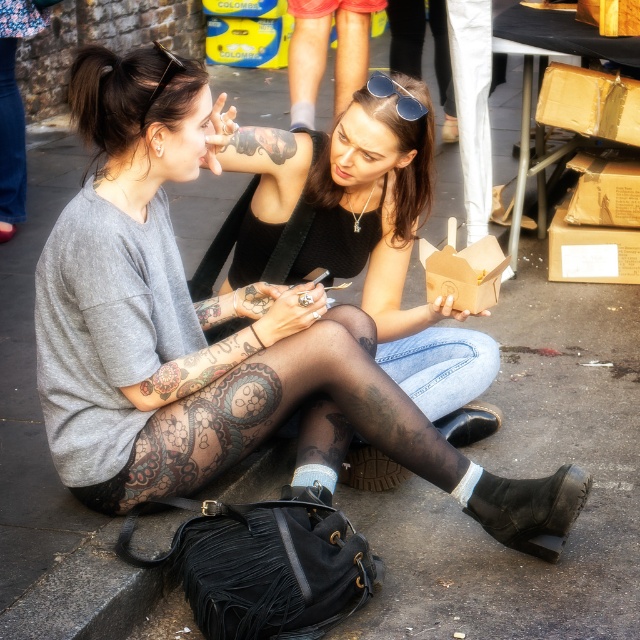
You are a photographer setting up a shot of the two people in the scene. You need to ensure that the matte black sunglasses at upper center and the sunglasses at center are both visible in the frame. Based on their positions, which sunglasses are positioned higher in the image?

The matte black sunglasses at upper center is positioned higher in the image than the sunglasses at center.